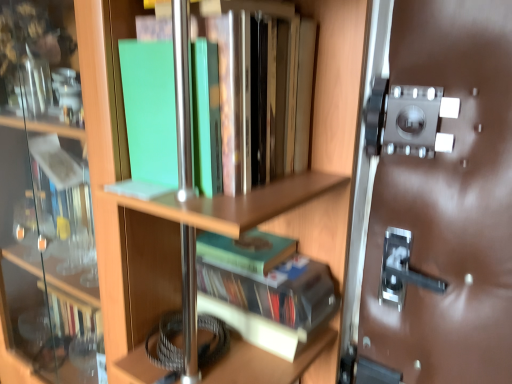
Question: Should I look upward or downward to see green matte book at center, the second book positioned from the bottom?

Choices:
 (A) down
 (B) up

Answer: (A)

Question: From a real-world perspective, is green matte book at center, which is the third book in top-to-bottom order, on green matte book at center, the second book positioned from the bottom?

Choices:
 (A) yes
 (B) no

Answer: (B)

Question: Is green matte book at center, which is the 1th book from bottom to top, in front of green matte book at center, acting as the 2th book starting from the top?

Choices:
 (A) yes
 (B) no

Answer: (A)

Question: Can you confirm if green matte book at center, which is the third book in top-to-bottom order, is bigger than green matte book at center, the second book positioned from the bottom?

Choices:
 (A) no
 (B) yes

Answer: (B)

Question: Is green matte book at center, which is the 1th book from bottom to top, wider than green matte book at center, the second book positioned from the bottom?

Choices:
 (A) yes
 (B) no

Answer: (A)

Question: Is the depth of green matte book at center, which is the third book in top-to-bottom order, greater than that of green matte book at center, the second book positioned from the bottom?

Choices:
 (A) yes
 (B) no

Answer: (B)

Question: Is green matte book at center, which is the 1th book from bottom to top, far away from green matte book at center, acting as the 2th book starting from the top?

Choices:
 (A) yes
 (B) no

Answer: (B)

Question: Is green matte book at upper left, the 3th book positioned from the bottom, turned away from green matte book at center, which is the 1th book from bottom to top?

Choices:
 (A) no
 (B) yes

Answer: (A)

Question: Does green matte book at upper left, which appears as the 1th book when viewed from the top, have a lesser height compared to green matte book at center, which is the third book in top-to-bottom order?

Choices:
 (A) no
 (B) yes

Answer: (A)

Question: Are green matte book at upper left, the 3th book positioned from the bottom, and green matte book at center, which is the third book in top-to-bottom order, beside each other?

Choices:
 (A) no
 (B) yes

Answer: (A)

Question: From the image's perspective, is green matte book at upper left, which appears as the 1th book when viewed from the top, located beneath green matte book at center, which is the 1th book from bottom to top?

Choices:
 (A) yes
 (B) no

Answer: (B)

Question: Is green matte book at upper left, which appears as the 1th book when viewed from the top, outside green matte book at center, which is the third book in top-to-bottom order?

Choices:
 (A) no
 (B) yes

Answer: (B)

Question: Is green matte book at center, which is the third book in top-to-bottom order, surrounded by green matte book at upper left, the 3th book positioned from the bottom?

Choices:
 (A) no
 (B) yes

Answer: (A)

Question: Does green matte book at center, which is the 1th book from bottom to top, appear on the left side of green matte book at upper left, which appears as the 1th book when viewed from the top?

Choices:
 (A) yes
 (B) no

Answer: (B)